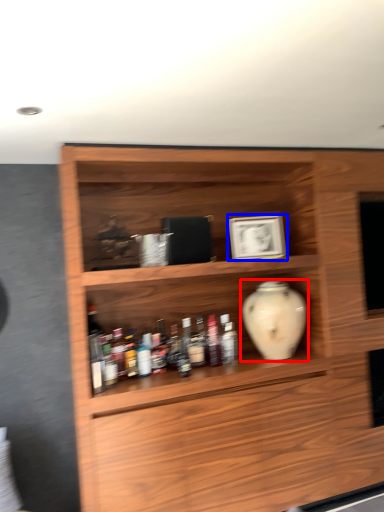
Question: Which object appears farthest to the camera in this image, vase (highlighted by a red box) or picture frame (highlighted by a blue box)?

Choices:
 (A) vase
 (B) picture frame

Answer: (B)